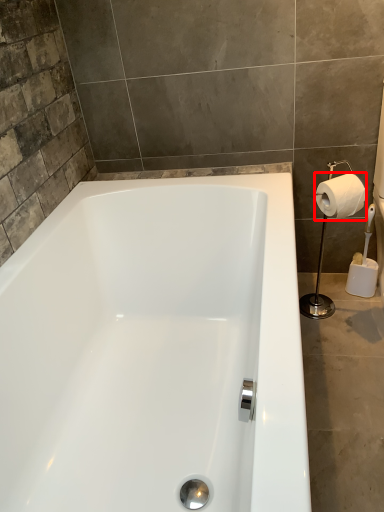
Question: Observing the image, what is the correct spatial positioning of toilet paper (annotated by the red box) in reference to shower?

Choices:
 (A) right
 (B) left

Answer: (A)